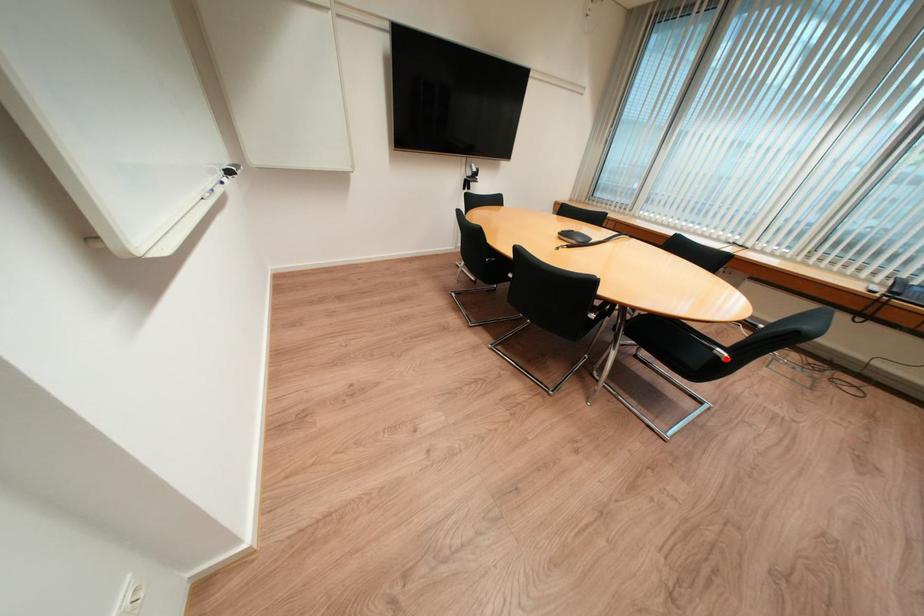
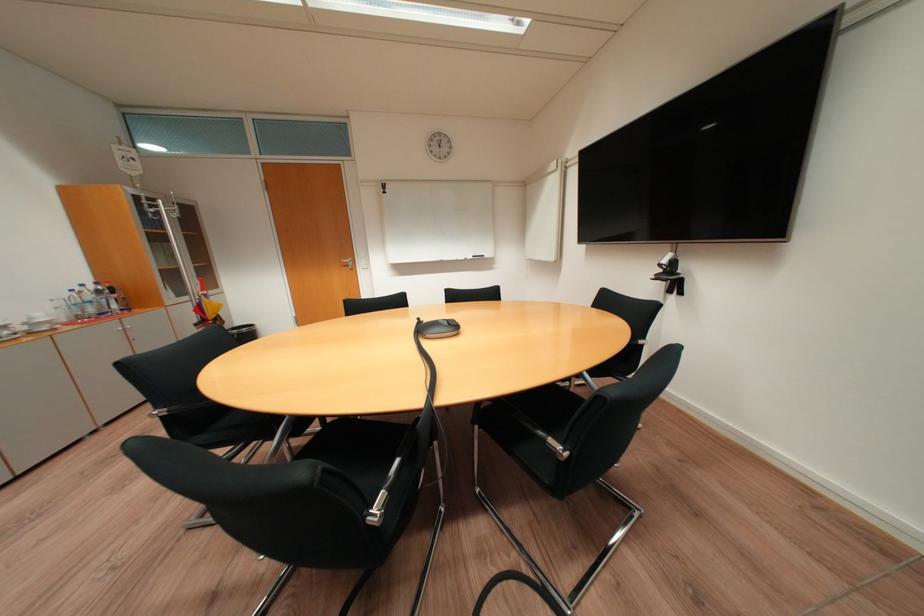
Question: I am providing you with two images of the same scene from different viewpoints. A red point is marked on the first image. At the location where the point appears in image 1, is it still visible in image 2?

Choices:
 (A) Yes
 (B) No

Answer: (B)